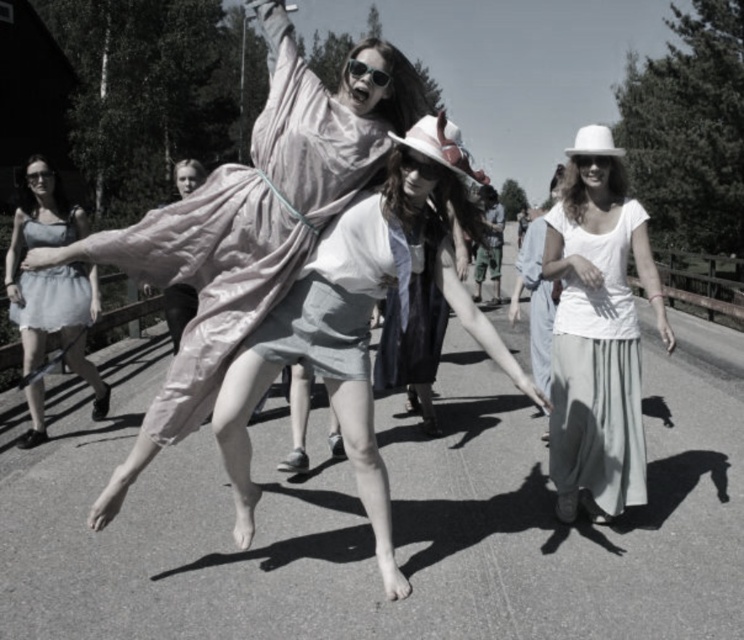
Is light blue denim dress at left closer to the viewer compared to matte gray dress at left?

That is True.

Who is taller, light blue denim dress at left or matte gray dress at left?

light blue denim dress at left is taller.

Which is behind, point (36, 230) or point (60, 292)?

Positioned behind is point (60, 292).

The height and width of the screenshot is (640, 744). Find the location of `light blue denim dress at left`. light blue denim dress at left is located at coordinates 51,296.

Does light gray denim shorts at center have a smaller size compared to shiny plastic sunglasses at center?

Incorrect, light gray denim shorts at center is not smaller in size than shiny plastic sunglasses at center.

The height and width of the screenshot is (640, 744). What do you see at coordinates (341, 330) in the screenshot? I see `light gray denim shorts at center` at bounding box center [341, 330].

Who is more distant from viewer, (498, 349) or (372, 67)?

The point (372, 67) is more distant.

Locate an element on the screen. This screenshot has width=744, height=640. light gray denim shorts at center is located at coordinates (341, 330).

In the scene shown: Who is more forward, [603,340] or [31,180]?

Point [603,340]

Measure the distance from white cotton hat at upper right to matte black goggles at upper left.

white cotton hat at upper right and matte black goggles at upper left are 16.09 feet apart from each other.

I want to click on white cotton hat at upper right, so click(597, 337).

Locate an element on the screen. white cotton hat at upper right is located at coordinates (597, 337).